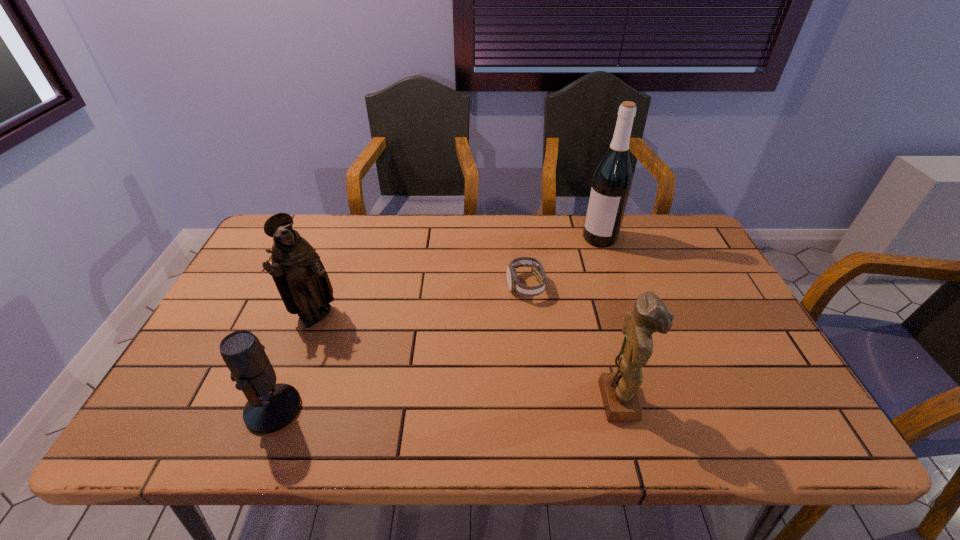
Locate an element on the screen. This screenshot has height=540, width=960. figurine located in the near edge section of the desktop is located at coordinates (619, 394).

Find the location of `free space at the far edge`. free space at the far edge is located at coordinates (414, 253).

You are a GUI agent. You are given a task and a screenshot of the screen. Output one action in this format:
    pyautogui.click(x=<x>, y=<y>)
    Task: Click on the vacant space at the near edge of the desktop
    This screenshot has height=540, width=960.
    Given the screenshot: What is the action you would take?
    pyautogui.click(x=495, y=389)

This screenshot has width=960, height=540. I want to click on vacant region at the left edge of the desktop, so click(217, 366).

The width and height of the screenshot is (960, 540). In order to click on vacant area at the right edge in this screenshot , I will do `click(692, 327)`.

The image size is (960, 540). In the image, there is a desktop. What are the coordinates of `free region at the far left corner` in the screenshot? It's located at (268, 259).

Where is `vacant space at the near left corner of the desktop`? vacant space at the near left corner of the desktop is located at coordinates (187, 396).

Where is `vacant space at the near right corner of the desktop`? Image resolution: width=960 pixels, height=540 pixels. vacant space at the near right corner of the desktop is located at coordinates (757, 375).

Image resolution: width=960 pixels, height=540 pixels. In order to click on vacant space in between the tallest object and the left figurine in this screenshot , I will do `click(458, 277)`.

I want to click on empty space that is in between the left figurine and the second shortest object, so click(295, 363).